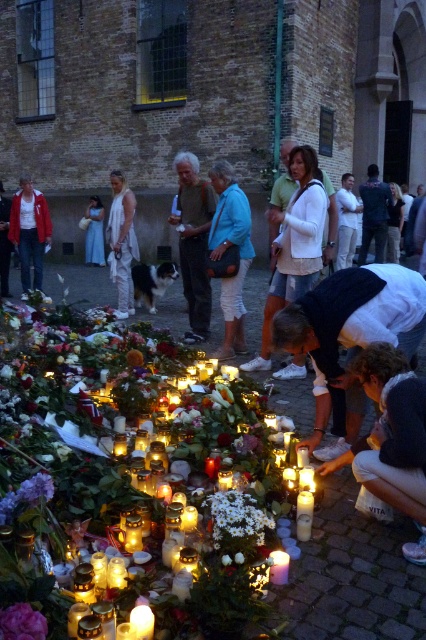
You are a photographer trying to capture the memorial scene. You notice the translucent glass candle at lower center and the white wax candle at lower center. Which candle allows you to see the flame more clearly through it?

The translucent glass candle at lower center allows you to see the flame more clearly through it because it is positioned over the white wax candle at lower center, making its transparency visible.